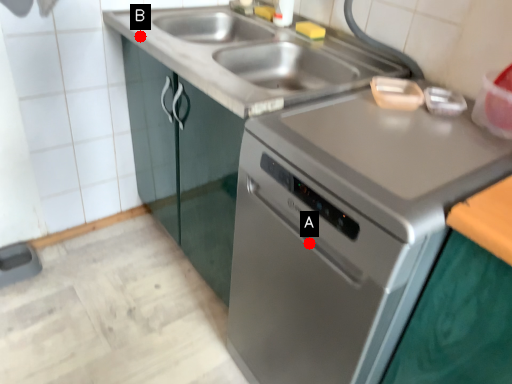
Question: Two points are circled on the image, labeled by A and B beside each circle. Which point is farther from the camera taking this photo?

Choices:
 (A) A is further
 (B) B is further

Answer: (B)